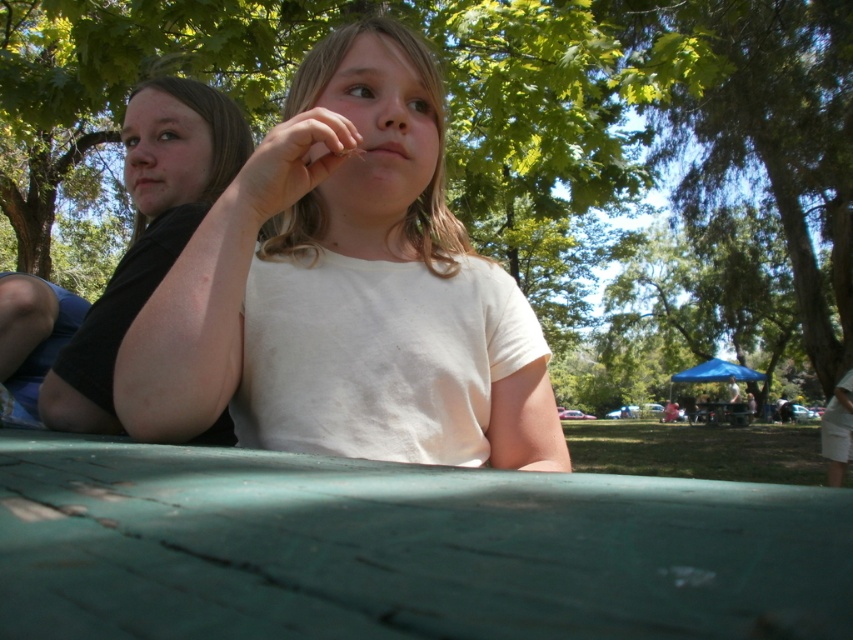
You are standing at the picnic table and want to take a photo of the green leafy tree at center and the smooth skin hand at center. Which object should you focus on first if you want to capture both in the same frame without moving the camera?

The green leafy tree at center is taller than the smooth skin hand at center, so you should focus on the green leafy tree at center first to ensure it fits within the frame.

You are planning to take a photo of the green leafy tree at center and the smooth skin hand at center. Which object should you focus on if you want to capture the larger one in your shot?

The green leafy tree at center is bigger than the smooth skin hand at center, so you should focus on the green leafy tree at center to capture the larger one in your shot.

You are standing at the entrance of the park and want to find the person wearing the white matte shirt at center. According to the image, where should you look relative to the green picnic table?

The white matte shirt at center is located at point 0.455 on the x axis and 0.406 on the y axis relative to the green picnic table, so you should look towards the center area of the picnic table to find the person.